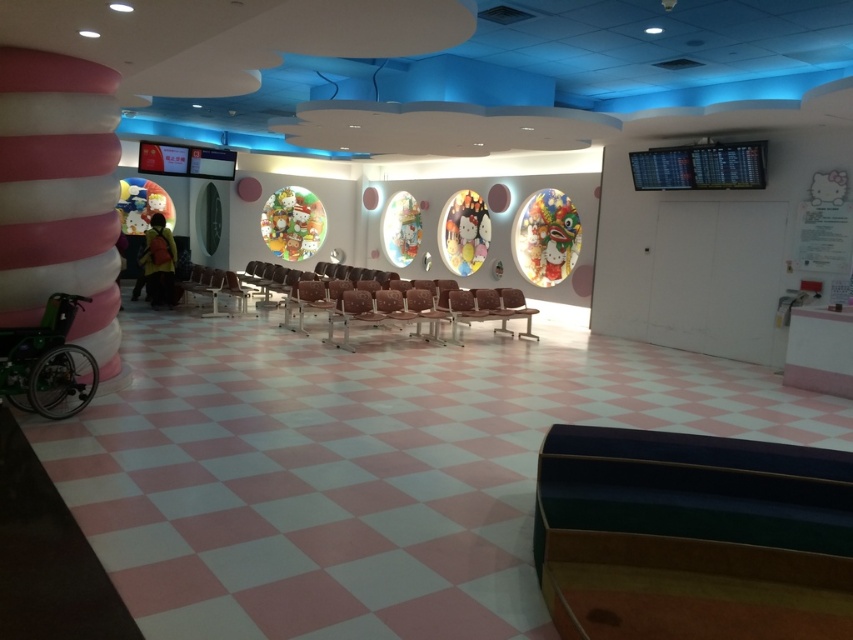
Which is below, dark green leather armchair at center or green plastic wheelchair at lower left?

dark green leather armchair at center is lower down.

Is dark green leather armchair at center above green plastic wheelchair at lower left?

No.

Between point (685, 605) and point (54, 365), which one is positioned in front?

Point (685, 605) is in front.

Identify the location of dark green leather armchair at center. The height and width of the screenshot is (640, 853). (692, 536).